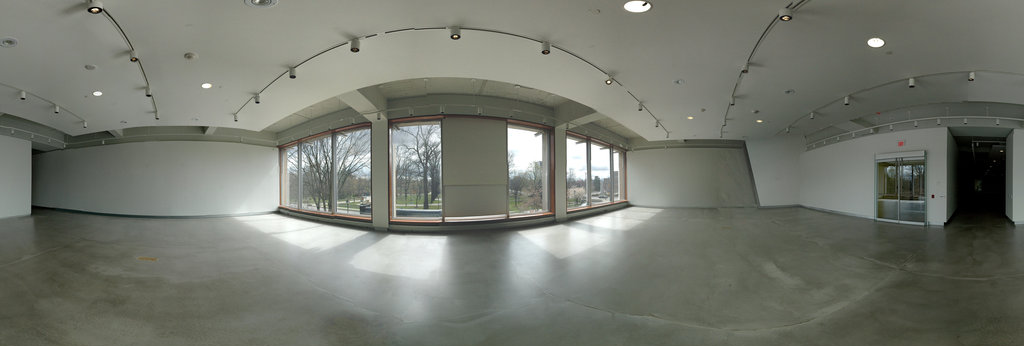
Where is `window`? Image resolution: width=1024 pixels, height=346 pixels. window is located at coordinates (287, 176), (312, 187), (352, 184), (418, 185), (516, 178), (582, 178), (602, 184), (620, 182).